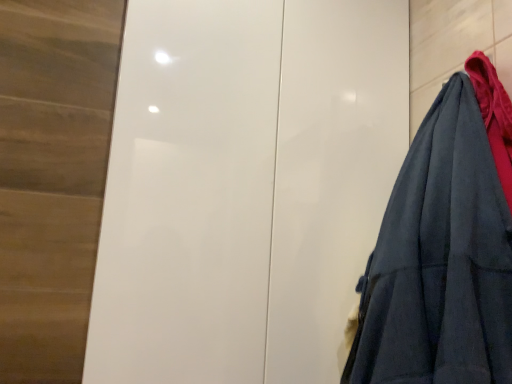
The width and height of the screenshot is (512, 384). What do you see at coordinates (245, 187) in the screenshot?
I see `white glossy door at center` at bounding box center [245, 187].

What is the approximate height of white glossy door at center?

white glossy door at center is 3.87 feet tall.

You are a GUI agent. You are given a task and a screenshot of the screen. Output one action in this format:
    pyautogui.click(x=<x>, y=<y>)
    Task: Click on the white glossy door at center
    Image resolution: width=512 pixels, height=384 pixels.
    Given the screenshot: What is the action you would take?
    pos(245,187)

I want to click on dark blue fabric at right, so click(x=445, y=248).

What do you see at coordinates (445, 248) in the screenshot? I see `dark blue fabric at right` at bounding box center [445, 248].

Image resolution: width=512 pixels, height=384 pixels. Find the location of `white glossy door at center`. white glossy door at center is located at coordinates (245, 187).

Considering the relative positions of white glossy door at center and dark blue fabric at right in the image provided, is white glossy door at center to the right of dark blue fabric at right from the viewer's perspective?

In fact, white glossy door at center is to the left of dark blue fabric at right.

Is white glossy door at center positioned before dark blue fabric at right?

No, it is behind dark blue fabric at right.

Which point is more distant from viewer, (365, 15) or (464, 279)?

Positioned behind is point (365, 15).

From the image's perspective, which object appears higher, white glossy door at center or dark blue fabric at right?

white glossy door at center.

From a real-world perspective, which object rests below the other?

In real-world perspective, dark blue fabric at right is lower.

Between white glossy door at center and dark blue fabric at right, which one has larger width?

Wider between the two is white glossy door at center.

Considering the relative sizes of white glossy door at center and dark blue fabric at right in the image provided, is white glossy door at center shorter than dark blue fabric at right?

No, white glossy door at center is not shorter than dark blue fabric at right.

Does white glossy door at center have a smaller size compared to dark blue fabric at right?

No, white glossy door at center is not smaller than dark blue fabric at right.

Can dark blue fabric at right be found inside white glossy door at center?

Definitely not — dark blue fabric at right is not inside white glossy door at center.

In the scene shown: Would you say white glossy door at center is a long distance from dark blue fabric at right?

No, there isn't a large distance between white glossy door at center and dark blue fabric at right.

Is white glossy door at center turned away from dark blue fabric at right?

No, dark blue fabric at right is not at the back of white glossy door at center.

Can you tell me how much white glossy door at center and dark blue fabric at right differ in facing direction?

The facing directions of white glossy door at center and dark blue fabric at right are 91.1 degrees apart.

In the image, there is a dark blue fabric at right. In order to click on door above it (from the image's perspective) in this screenshot , I will do `click(245, 187)`.

Considering the relative positions of dark blue fabric at right and white glossy door at center in the image provided, is dark blue fabric at right to the right of white glossy door at center from the viewer's perspective?

Yes, dark blue fabric at right is to the right of white glossy door at center.

Is dark blue fabric at right further to the viewer compared to white glossy door at center?

No.

Is point (488, 81) more distant than point (150, 257)?

No, (488, 81) is closer to viewer.

From the image's perspective, between dark blue fabric at right and white glossy door at center, which one is located above?

white glossy door at center is shown above in the image.

From a real-world perspective, is dark blue fabric at right positioned over white glossy door at center based on gravity?

Actually, dark blue fabric at right is physically below white glossy door at center in the real world.

Between dark blue fabric at right and white glossy door at center, which one has larger width?

With larger width is white glossy door at center.

Between dark blue fabric at right and white glossy door at center, which one has less height?

Standing shorter between the two is dark blue fabric at right.

Can you confirm if dark blue fabric at right is bigger than white glossy door at center?

No, dark blue fabric at right is not bigger than white glossy door at center.

Could white glossy door at center be considered to be inside dark blue fabric at right?

No, dark blue fabric at right does not contain white glossy door at center.

Would you say dark blue fabric at right is a long distance from white glossy door at center?

No, there isn't a large distance between dark blue fabric at right and white glossy door at center.

Does dark blue fabric at right turn towards white glossy door at center?

No, dark blue fabric at right is not aimed at white glossy door at center.

How far apart are dark blue fabric at right and white glossy door at center?

10.11 inches.

You are a GUI agent. You are given a task and a screenshot of the screen. Output one action in this format:
    pyautogui.click(x=<x>, y=<y>)
    Task: Click on the door behind the dark blue fabric at right
    
    Given the screenshot: What is the action you would take?
    pyautogui.click(x=245, y=187)

Find the location of a particular element. The width and height of the screenshot is (512, 384). garment below the white glossy door at center (from a real-world perspective) is located at coordinates (445, 248).

Locate an element on the screen. The height and width of the screenshot is (384, 512). door lying behind the dark blue fabric at right is located at coordinates 245,187.